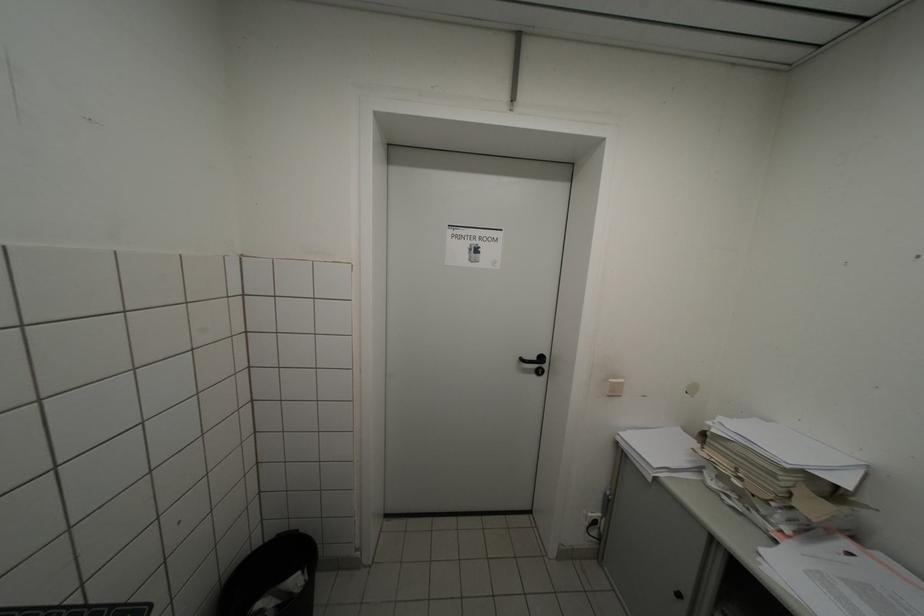
The image size is (924, 616). What do you see at coordinates (614, 387) in the screenshot? I see `the white light switch` at bounding box center [614, 387].